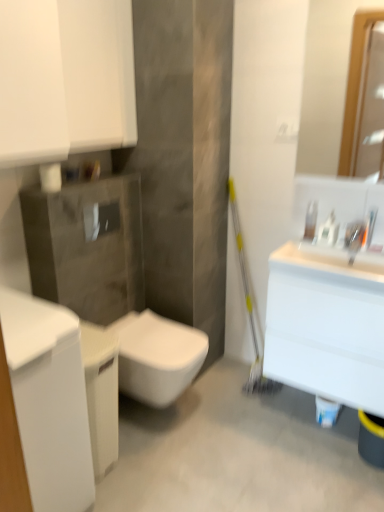
The width and height of the screenshot is (384, 512). Identify the location of free area below white glossy sink at upper right (from a real-world perspective). (307, 411).